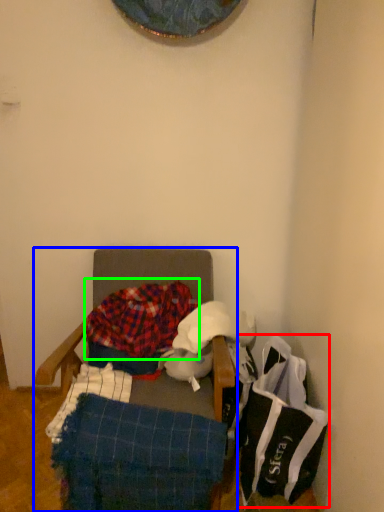
Question: Which object is the farthest from material (highlighted by a red box)? Choose among these: furniture (highlighted by a blue box) or blanket (highlighted by a green box).

Choices:
 (A) furniture
 (B) blanket

Answer: (A)